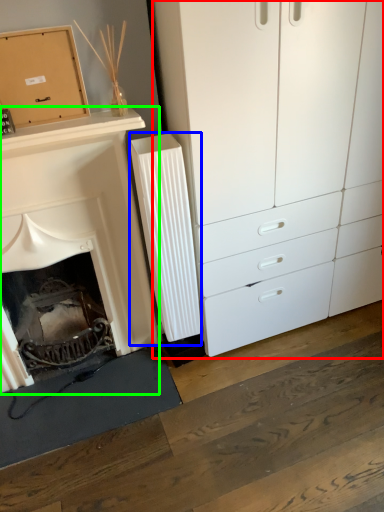
Question: Which object is positioned farthest from chest of drawers (highlighted by a red box)? Select from radiator (highlighted by a blue box) and fireplace (highlighted by a green box).

Choices:
 (A) radiator
 (B) fireplace

Answer: (B)